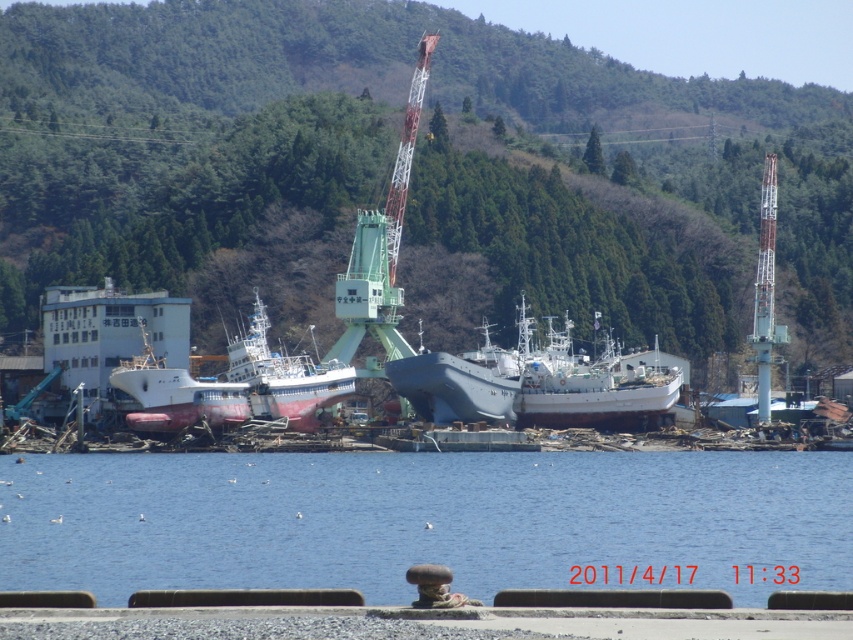
You are a photographer planning to capture a wide shot of the shipyard. Given the green forested hillside at upper center and the blue water at center, which one will occupy more of the frame in your photo?

The green forested hillside at upper center occupies more of the frame than the blue water at center because it has a larger size compared to the blue water at center.

You are a dock worker who needs to ensure that the blue metallic ship at center and the white matte boat at center can both fit through a narrow channel that is 10 meters wide. Based on their widths, can both ships pass through the channel simultaneously without touching each other?

The blue metallic ship at center might be wider than the white matte boat at center. Since the channel is 10 meters wide, if the combined width of both ships is less than or equal to 10 meters, they could potentially pass through together. However, without knowing their exact widths, it is uncertain if they can fit without touching.